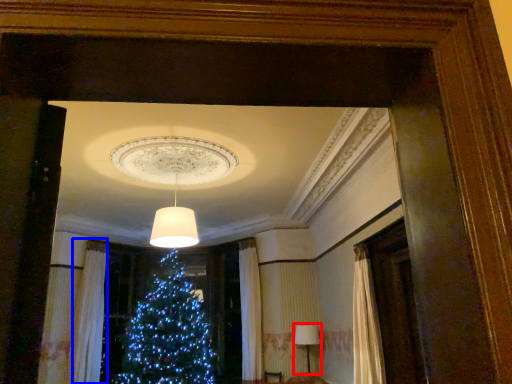
Question: Which object is further to the camera taking this photo, lamp (highlighted by a red box) or curtain (highlighted by a blue box)?

Choices:
 (A) lamp
 (B) curtain

Answer: (B)